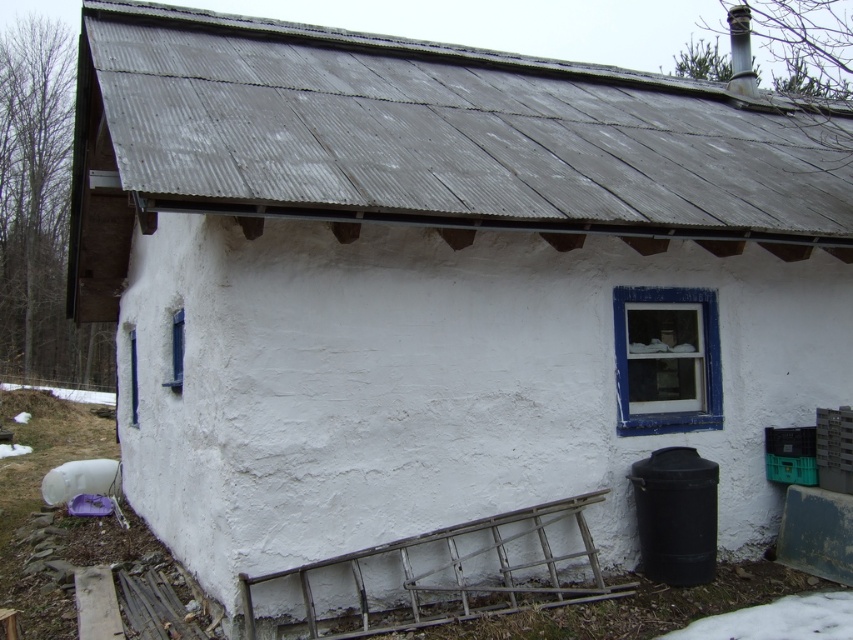
You are standing in front of the building and want to place a large decorative item on the gray corrugated metal roof at upper center. Considering the size of the roof compared to the blue painted wood window at right, do you think the roof has enough space to accommodate the item?

The gray corrugated metal roof at upper center is larger in size than the blue painted wood window at right, so it likely has enough space to accommodate the large decorative item.

You are standing in front of the building and want to see if you can reach the blue matte window at left without stepping on the white powdery snow at lower right. Is this possible?

The white powdery snow at lower right is closer to the viewer than the blue matte window at left, so you can reach the blue matte window at left without stepping on the snow by approaching it from a path that avoids the snow area.